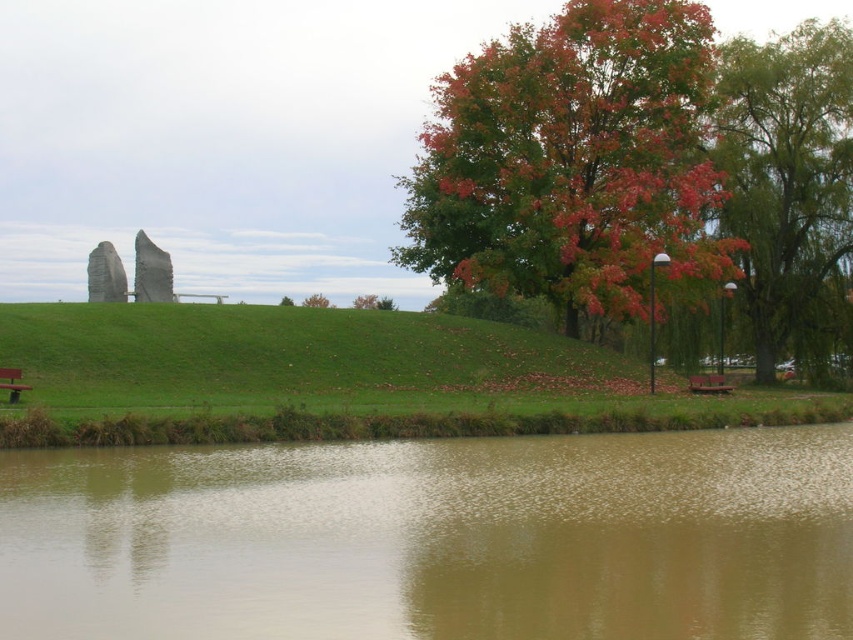
Is brown muddy water at lower center closer to camera compared to wooden park bench at lower right?

That is True.

Can you confirm if brown muddy water at lower center is positioned to the right of wooden park bench at lower right?

In fact, brown muddy water at lower center is to the left of wooden park bench at lower right.

Is point (700, 528) closer to camera compared to point (701, 390)?

Yes, it is in front of point (701, 390).

What are the coordinates of `brown muddy water at lower center` in the screenshot? It's located at (434, 538).

Can you confirm if green leafy tree at upper right is smaller than wooden park bench at lower left?

No.

Can you confirm if green leafy tree at upper right is shorter than wooden park bench at lower left?

Incorrect, green leafy tree at upper right's height does not fall short of wooden park bench at lower left's.

Find the location of `green leafy tree at upper right`. green leafy tree at upper right is located at coordinates (786, 176).

Is green leafy tree at upper right in front of green matte tree at center?

No, green leafy tree at upper right is behind green matte tree at center.

Does green leafy tree at upper right have a greater height compared to green matte tree at center?

Indeed, green leafy tree at upper right has a greater height compared to green matte tree at center.

Where is `green leafy tree at upper right`? The image size is (853, 640). green leafy tree at upper right is located at coordinates (786, 176).